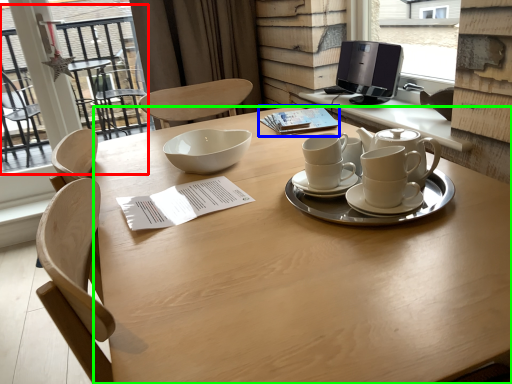
Question: Which is farther away from glass door (highlighted by a red box)? notepad (highlighted by a blue box) or desk (highlighted by a green box)?

Choices:
 (A) notepad
 (B) desk

Answer: (B)